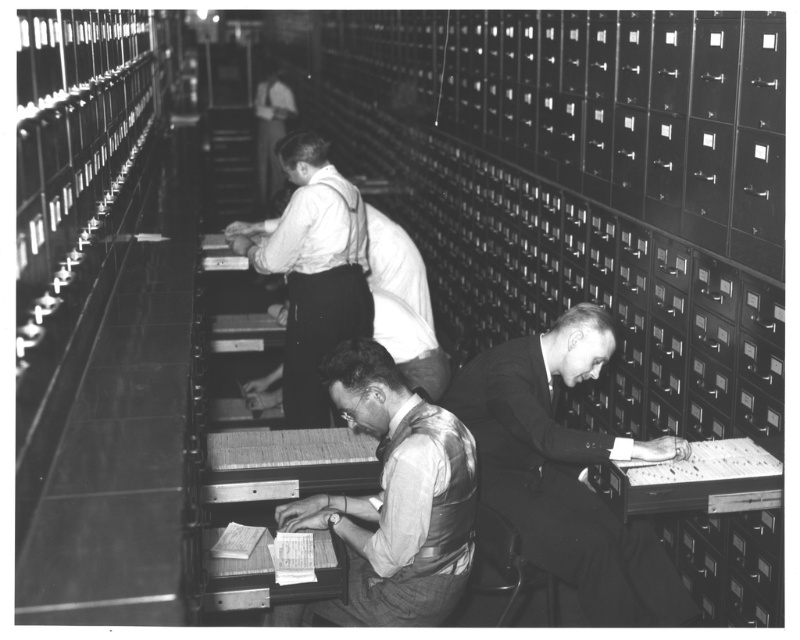
Which is above, light gray fabric vest at center or light gray shirt at center?

light gray shirt at center

Is light gray fabric vest at center thinner than light gray shirt at center?

Yes.

Between point (368, 353) and point (348, 244), which one is positioned in front?

Point (368, 353) is more forward.

Identify the location of light gray fabric vest at center. The image size is (800, 640). (393, 500).

Can you confirm if smooth black suit at center is positioned above light gray fabric vest at center?

No, smooth black suit at center is not above light gray fabric vest at center.

In the scene shown: Does smooth black suit at center have a lesser width compared to light gray fabric vest at center?

No.

Between point (525, 419) and point (437, 451), which one is positioned behind?

The point (525, 419) is behind.

The height and width of the screenshot is (640, 800). I want to click on smooth black suit at center, so click(x=566, y=472).

Does smooth black suit at center have a greater width compared to light gray shirt at center?

No.

From the picture: Can you confirm if smooth black suit at center is smaller than light gray shirt at center?

Correct, smooth black suit at center occupies less space than light gray shirt at center.

Measure the distance between smooth black suit at center and camera.

smooth black suit at center and camera are 2.50 meters apart from each other.

Locate an element on the screen. Image resolution: width=800 pixels, height=640 pixels. smooth black suit at center is located at coordinates (566, 472).